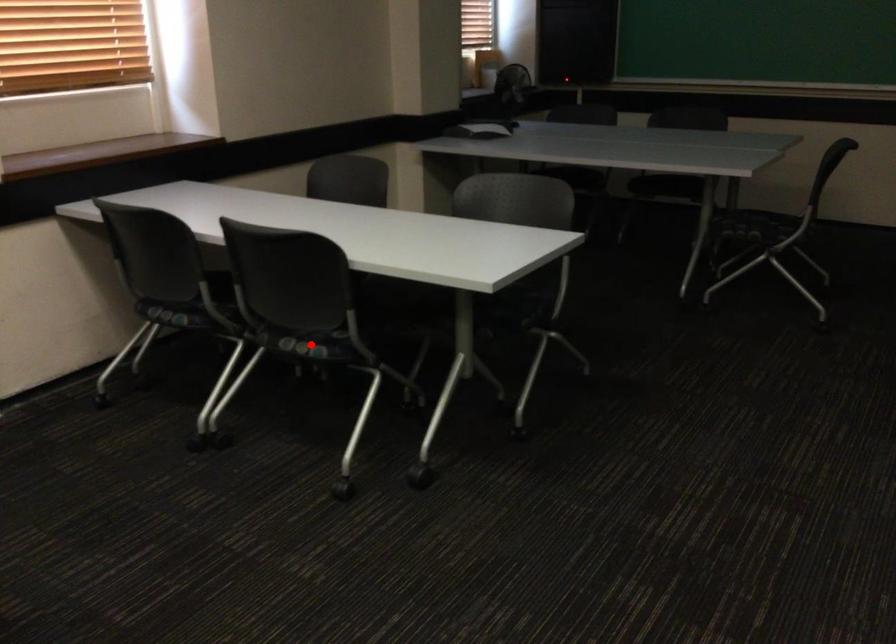
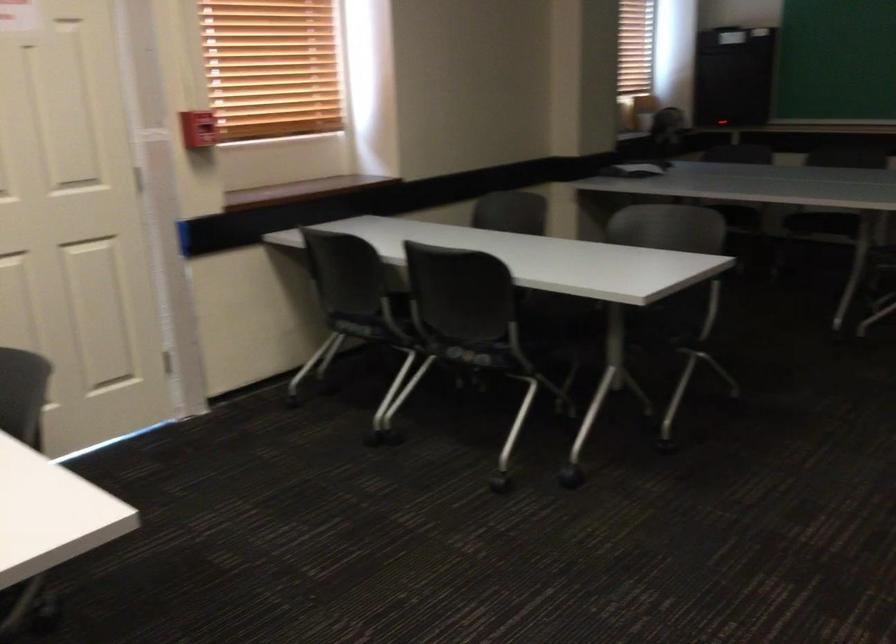
Question: I am providing you with two images of the same scene from different viewpoints. In image1, a red point is highlighted. Considering the same 3D point in image2, which of the following is correct?

Choices:
 (A) It is closer
 (B) It is farther

Answer: (B)